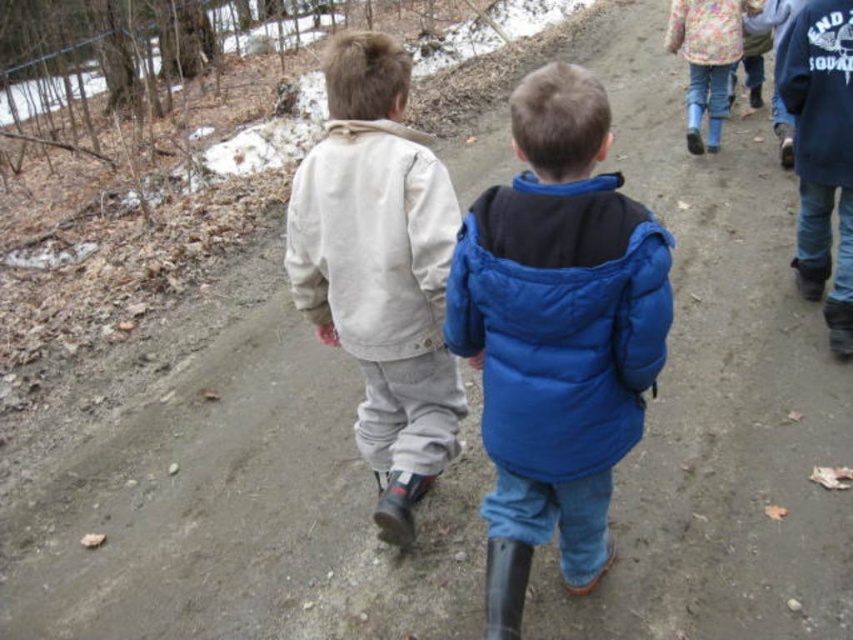
Is the position of blue puffy jacket at center less distant than that of light beige cotton jacket at center?

That is True.

The height and width of the screenshot is (640, 853). In order to click on blue puffy jacket at center in this screenshot , I will do `click(560, 321)`.

Which is in front, point (341, 189) or point (329, 243)?

Point (341, 189) is in front.

You are a GUI agent. You are given a task and a screenshot of the screen. Output one action in this format:
    pyautogui.click(x=<x>, y=<y>)
    Task: Click on the light beige fleece jacket at center
    The image size is (853, 640).
    Given the screenshot: What is the action you would take?
    (380, 269)

Can you confirm if light beige fleece jacket at center is positioned above blue puffy jacket at center?

Indeed, light beige fleece jacket at center is positioned over blue puffy jacket at center.

At what (x,y) coordinates should I click in order to perform the action: click on light beige fleece jacket at center. Please return your answer as a coordinate pair (x, y). Looking at the image, I should click on (380, 269).

Between point (416, 476) and point (521, 422), which one is positioned behind?

The point (416, 476) is behind.

The image size is (853, 640). I want to click on light beige fleece jacket at center, so click(380, 269).